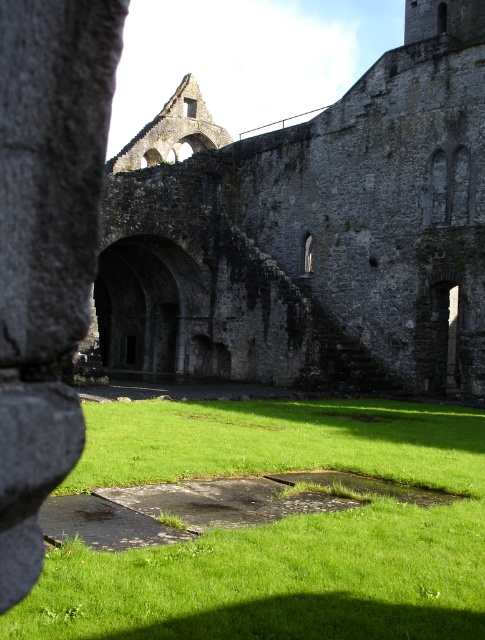
Does stone archway at center appear over green grass at center?

Yes, stone archway at center is above green grass at center.

Which is in front, point (143, 147) or point (298, 412)?

Positioned in front is point (298, 412).

Locate an element on the screen. stone archway at center is located at coordinates (307, 234).

The height and width of the screenshot is (640, 485). I want to click on stone archway at center, so click(307, 234).